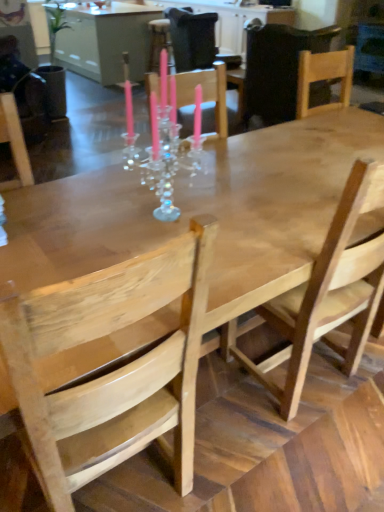
Question: Is natural wood chair at upper right, the 3th chair from the front, beside natural wood chair at center, which ranks as the 3th chair in back-to-front order?

Choices:
 (A) no
 (B) yes

Answer: (A)

Question: Is natural wood chair at center, which ranks as the 3th chair in back-to-front order, at the back of natural wood chair at upper right, the 3th chair from the front?

Choices:
 (A) no
 (B) yes

Answer: (A)

Question: Would you say natural wood chair at upper right, the 3th chair from the front, is a long distance from natural wood chair at center, which ranks as the 3th chair in back-to-front order?

Choices:
 (A) yes
 (B) no

Answer: (A)

Question: Is natural wood chair at upper right, the second chair from the back, not within natural wood chair at center, which ranks as the 3th chair in back-to-front order?

Choices:
 (A) yes
 (B) no

Answer: (A)

Question: From the image's perspective, does natural wood chair at upper right, the 3th chair from the front, appear higher than natural wood chair at center, the 2th chair from the front?

Choices:
 (A) yes
 (B) no

Answer: (A)

Question: From their relative heights in the image, would you say wooden table at center is taller or shorter than natural wood chair at left, placed as the first chair when sorted from front to back?

Choices:
 (A) short
 (B) tall

Answer: (A)

Question: In terms of width, does wooden table at center look wider or thinner when compared to natural wood chair at left, placed as the fourth chair when sorted from back to front?

Choices:
 (A) wide
 (B) thin

Answer: (A)

Question: Based on their sizes in the image, would you say wooden table at center is bigger or smaller than natural wood chair at left, placed as the first chair when sorted from front to back?

Choices:
 (A) big
 (B) small

Answer: (A)

Question: From the image's perspective, relative to natural wood chair at left, placed as the first chair when sorted from front to back, is wooden table at center above or below?

Choices:
 (A) above
 (B) below

Answer: (A)

Question: Is point (377, 276) positioned closer to the camera than point (119, 62)?

Choices:
 (A) farther
 (B) closer

Answer: (B)

Question: Looking at their shapes, would you say natural wood chair at center, which ranks as the 3th chair in back-to-front order, is wider or thinner than wooden table at center?

Choices:
 (A) wide
 (B) thin

Answer: (B)

Question: In terms of size, does natural wood chair at center, which ranks as the 3th chair in back-to-front order, appear bigger or smaller than wooden table at center?

Choices:
 (A) big
 (B) small

Answer: (B)

Question: Is natural wood chair at center, which ranks as the 3th chair in back-to-front order, taller or shorter than wooden table at center?

Choices:
 (A) tall
 (B) short

Answer: (A)

Question: In terms of size, does wooden table at center appear bigger or smaller than wooden chair at center, the fourth chair viewed from the front?

Choices:
 (A) small
 (B) big

Answer: (B)

Question: Considering the positions of wooden table at center and wooden chair at center, the first chair viewed from the back, in the image, is wooden table at center taller or shorter than wooden chair at center, the first chair viewed from the back,?

Choices:
 (A) short
 (B) tall

Answer: (A)